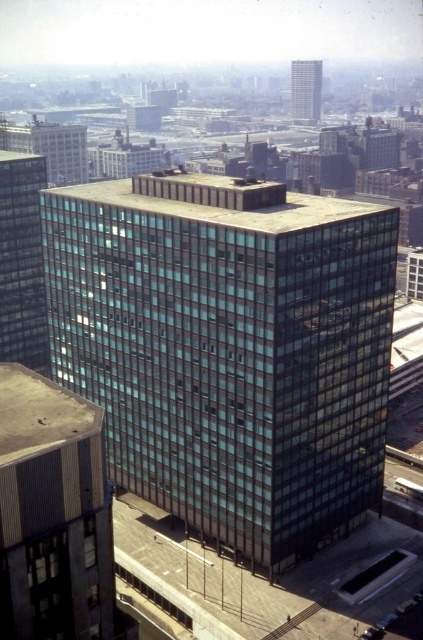
Does point (236, 492) come behind point (313, 77)?

No, (236, 492) is in front of (313, 77).

The width and height of the screenshot is (423, 640). In order to click on glassy black building at center in this screenshot , I will do `click(228, 349)`.

Between point (147, 442) and point (308, 93), which one is positioned behind?

Positioned behind is point (308, 93).

You are a GUI agent. You are given a task and a screenshot of the screen. Output one action in this format:
    pyautogui.click(x=<x>, y=<y>)
    Task: Click on the glassy black building at center
    Image resolution: width=423 pixels, height=640 pixels.
    Given the screenshot: What is the action you would take?
    pyautogui.click(x=228, y=349)

Is point (114, 188) in front of point (30, 218)?

Yes, point (114, 188) is in front of point (30, 218).

Which is in front, point (379, 412) or point (13, 312)?

Point (379, 412) is in front.

The image size is (423, 640). Find the location of `glassy black building at center`. glassy black building at center is located at coordinates (228, 349).

Can you confirm if glassy reflective building at left is taller than glassy reflective skyscraper at upper center?

Indeed, glassy reflective building at left has a greater height compared to glassy reflective skyscraper at upper center.

Is glassy reflective building at left below glassy reflective skyscraper at upper center?

Correct, glassy reflective building at left is located below glassy reflective skyscraper at upper center.

Who is more distant from viewer, (30, 262) or (318, 77)?

The point (318, 77) is behind.

This screenshot has height=640, width=423. Identify the location of glassy reflective building at left. (21, 262).